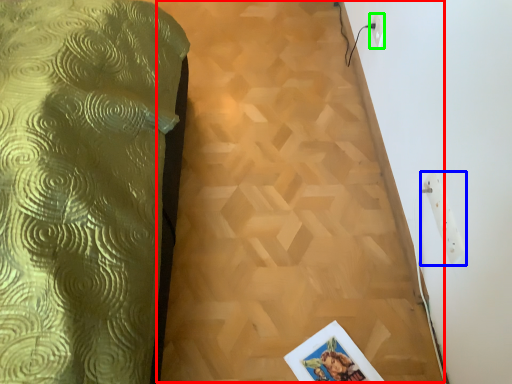
Question: Which is farther away from plywood (highlighted by a red box)? electric outlet (highlighted by a blue box) or electric outlet (highlighted by a green box)?

Choices:
 (A) electric outlet
 (B) electric outlet

Answer: (B)